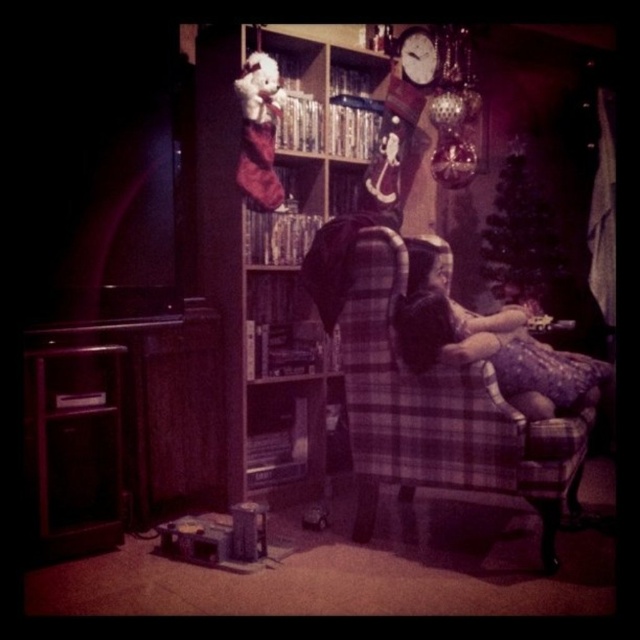
Question: Which point is closer to the camera?

Choices:
 (A) (426, 260)
 (B) (268, 355)
 (C) (484, 396)

Answer: (C)

Question: Is plaid fabric armchair at center wider than matte purple dress at center?

Choices:
 (A) no
 (B) yes

Answer: (B)

Question: Can you confirm if plaid fabric chair at center is positioned above matte purple dress at center?

Choices:
 (A) no
 (B) yes

Answer: (B)

Question: Among these points, which one is farthest from the camera?

Choices:
 (A) (412, 330)
 (B) (333, 145)

Answer: (B)

Question: Does plaid fabric chair at center appear on the right side of matte purple dress at center?

Choices:
 (A) yes
 (B) no

Answer: (B)

Question: Which of the following is the closest to the observer?

Choices:
 (A) (410, 419)
 (B) (250, 474)

Answer: (A)